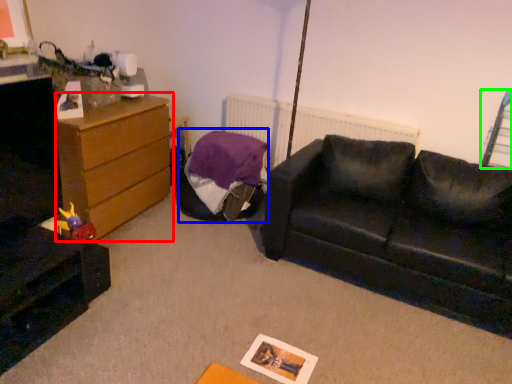
Question: Which is nearer to the chest of drawers (highlighted by a red box)? bean bag chair (highlighted by a blue box) or swivel chair (highlighted by a green box).

Choices:
 (A) bean bag chair
 (B) swivel chair

Answer: (A)